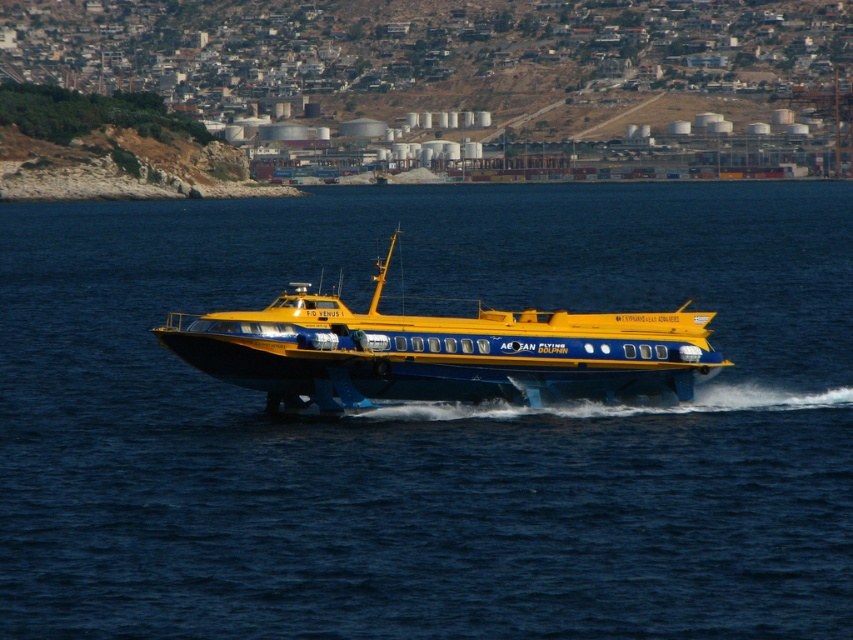
Question: Is blue water at center positioned behind yellow matte hydrofoil at center?

Choices:
 (A) no
 (B) yes

Answer: (A)

Question: Is blue water at center positioned behind yellow matte hydrofoil at center?

Choices:
 (A) yes
 (B) no

Answer: (B)

Question: Is blue water at center wider than yellow matte hydrofoil at center?

Choices:
 (A) yes
 (B) no

Answer: (A)

Question: Which point is farther to the camera?

Choices:
 (A) yellow matte hydrofoil at center
 (B) blue water at center

Answer: (A)